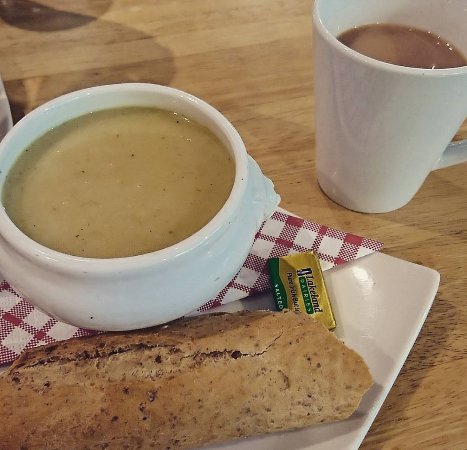
Identify the location of tabletop. The width and height of the screenshot is (467, 450). (434, 243).